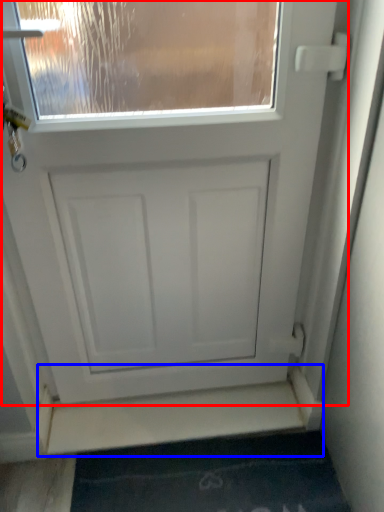
Question: Which object is closer to the camera taking this photo, door (highlighted by a red box) or stairwell (highlighted by a blue box)?

Choices:
 (A) door
 (B) stairwell

Answer: (A)